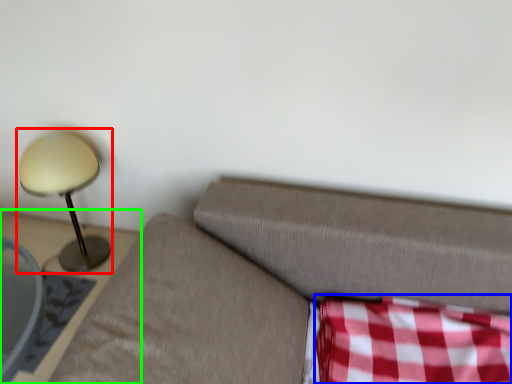
Question: Which object is positioned farthest from lamp (highlighted by a red box)? Select from plaid (highlighted by a blue box) and furniture (highlighted by a green box).

Choices:
 (A) plaid
 (B) furniture

Answer: (A)